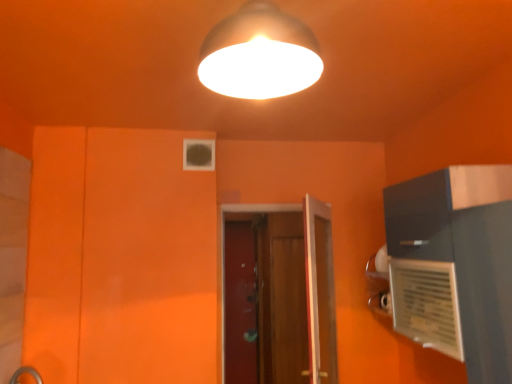
Question: Which direction should I rotate to face wooden screen door at center, which is the first screen door in right-to-left order, — up or down?

Choices:
 (A) down
 (B) up

Answer: (A)

Question: Would you say transparent glass screen door at center, which is the 1th screen door in left-to-right order, is outside matte white lampshade at upper center?

Choices:
 (A) no
 (B) yes

Answer: (B)

Question: Can you confirm if transparent glass screen door at center, which appears as the second screen door when viewed from the right, is smaller than matte white lampshade at upper center?

Choices:
 (A) yes
 (B) no

Answer: (A)

Question: Is transparent glass screen door at center, which is the 1th screen door in left-to-right order, aimed at matte white lampshade at upper center?

Choices:
 (A) no
 (B) yes

Answer: (B)

Question: Does transparent glass screen door at center, which is the 1th screen door in left-to-right order, have a larger size compared to matte white lampshade at upper center?

Choices:
 (A) yes
 (B) no

Answer: (B)

Question: Does transparent glass screen door at center, which is the 1th screen door in left-to-right order, come behind matte white lampshade at upper center?

Choices:
 (A) yes
 (B) no

Answer: (A)

Question: Is transparent glass screen door at center, which appears as the second screen door when viewed from the right, looking in the opposite direction of matte white lampshade at upper center?

Choices:
 (A) no
 (B) yes

Answer: (A)

Question: Is wooden door at center not within wooden screen door at center, which is the first screen door in right-to-left order?

Choices:
 (A) no
 (B) yes

Answer: (B)

Question: Does wooden door at center appear on the left side of wooden screen door at center, which is the first screen door in right-to-left order?

Choices:
 (A) no
 (B) yes

Answer: (B)

Question: From a real-world perspective, is wooden door at center on top of wooden screen door at center, which appears as the 2th screen door when viewed from the left?

Choices:
 (A) no
 (B) yes

Answer: (B)

Question: Can you see wooden door at center touching wooden screen door at center, which is the first screen door in right-to-left order?

Choices:
 (A) yes
 (B) no

Answer: (B)

Question: From a real-world perspective, is wooden door at center below wooden screen door at center, which is the first screen door in right-to-left order?

Choices:
 (A) no
 (B) yes

Answer: (A)

Question: Is wooden door at center looking in the opposite direction of wooden screen door at center, which is the first screen door in right-to-left order?

Choices:
 (A) yes
 (B) no

Answer: (A)

Question: Is wooden door at center positioned with its back to matte white lampshade at upper center?

Choices:
 (A) no
 (B) yes

Answer: (A)